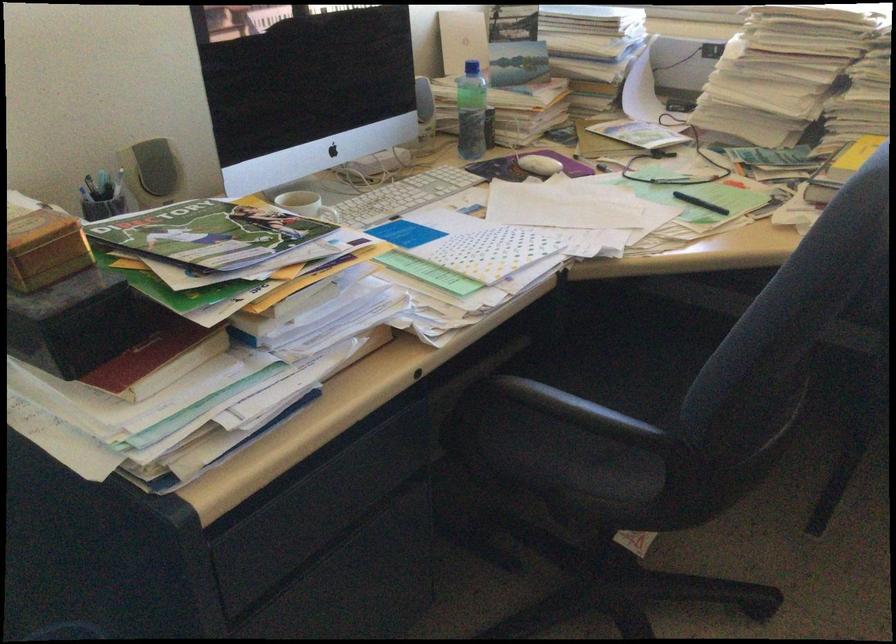
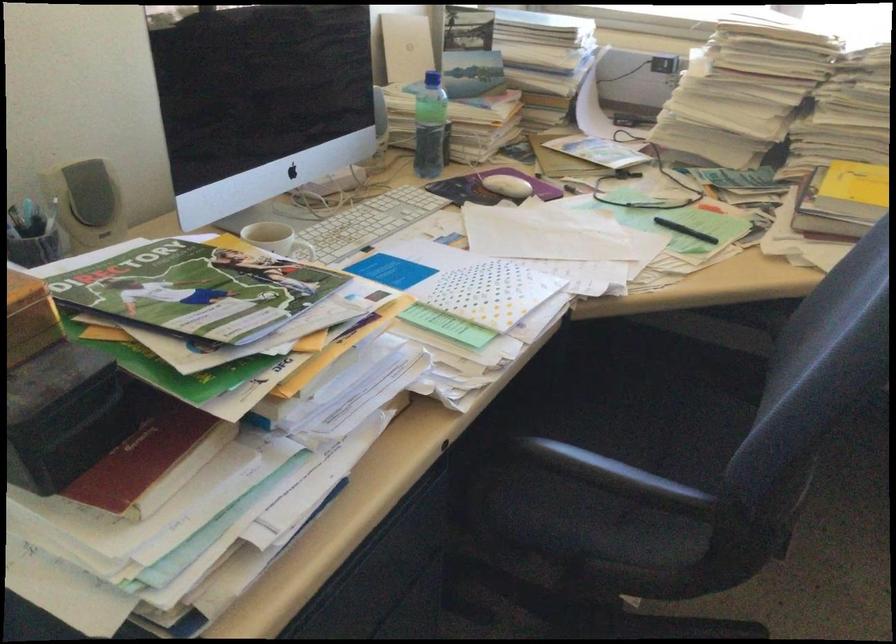
Where in the second image is the point corresponding to point (328, 219) from the first image?

(306, 252)